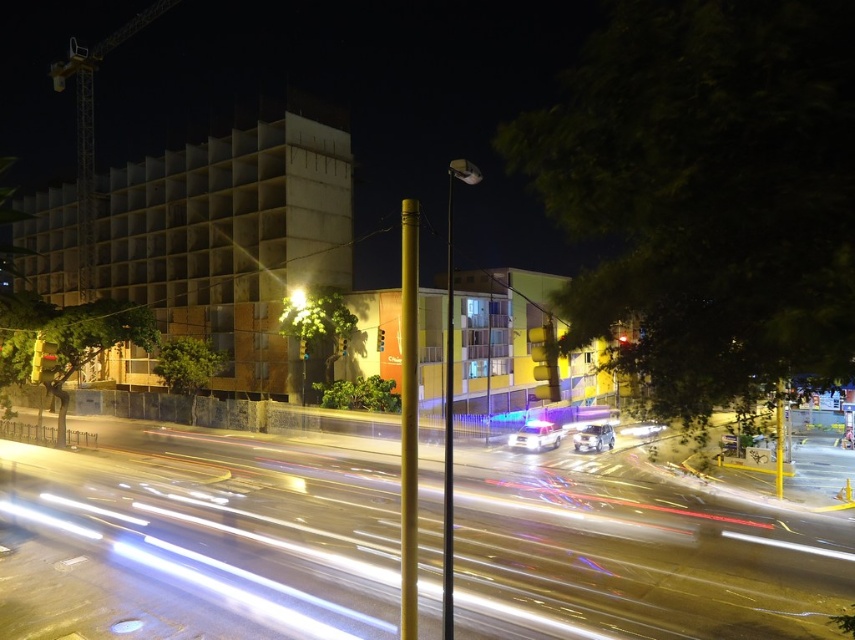
You are a pedestrian standing on the sidewalk and see the white glossy car at center and the matte yellow light at center. Which object is closer to the right edge of the road?

The white glossy car at center is positioned on the right side of the matte yellow light at center, so it is closer to the right edge of the road.

In the scene shown: You are a photographer trying to capture both the white glossy car at center and the shiny silver car at center in a single frame. Given their sizes in the image, which car will appear smaller?

The white glossy car at center appears smaller because it occupies less space in the image compared to the shiny silver car at center.

You are a pedestrian standing at the edge of the road. You see a shiny silver car at center and a matte yellow light at center. Which object is closer to your right side?

The shiny silver car at center is to the right of the matte yellow light at center, so it is closer to your right side.